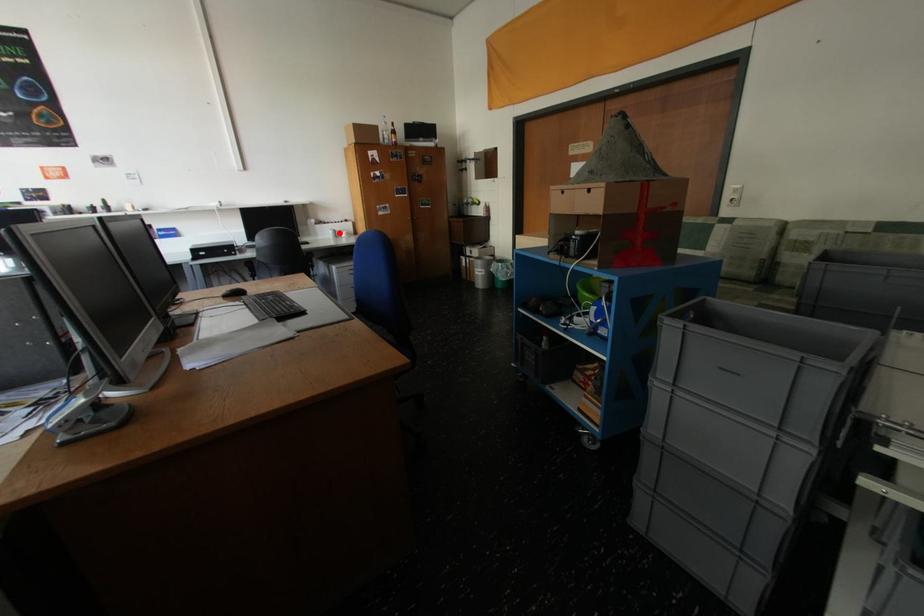
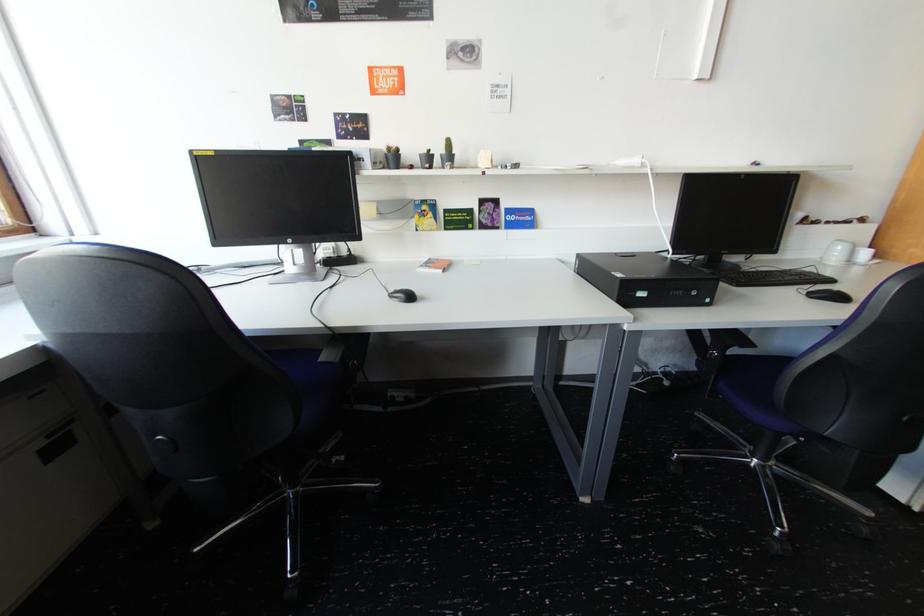
Find the pixel in the second image that matches the highlighted location in the first image.

(849, 249)